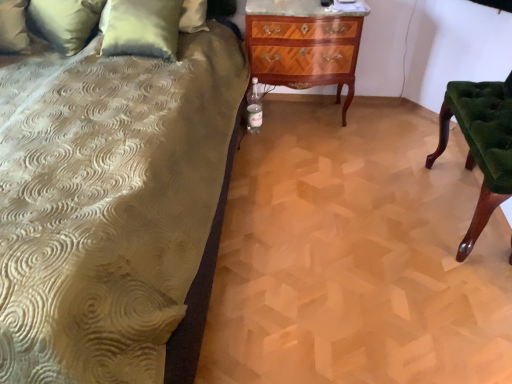
Where is `free spot below mahogany wood chest of drawers at center (from a real-world perspective)`? The width and height of the screenshot is (512, 384). free spot below mahogany wood chest of drawers at center (from a real-world perspective) is located at coordinates (303, 112).